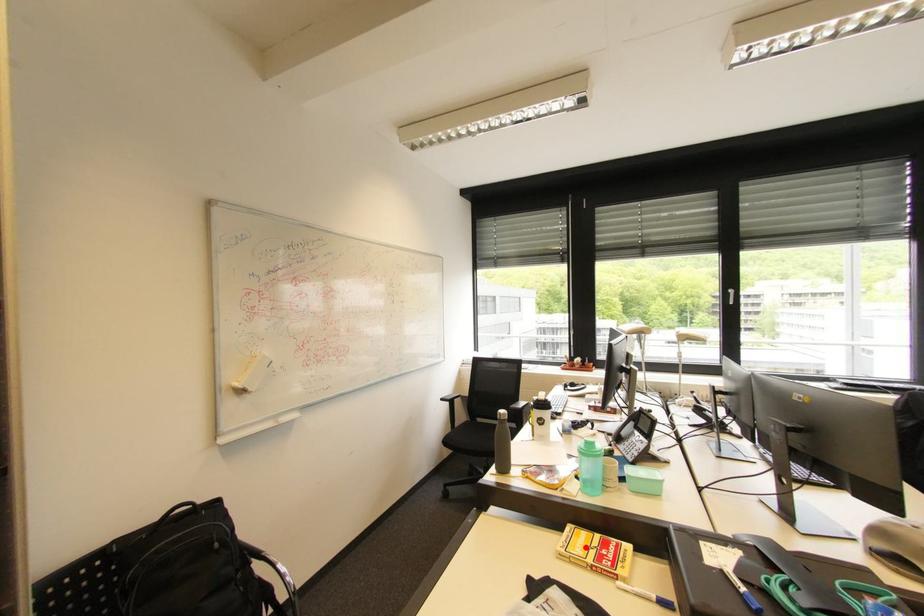
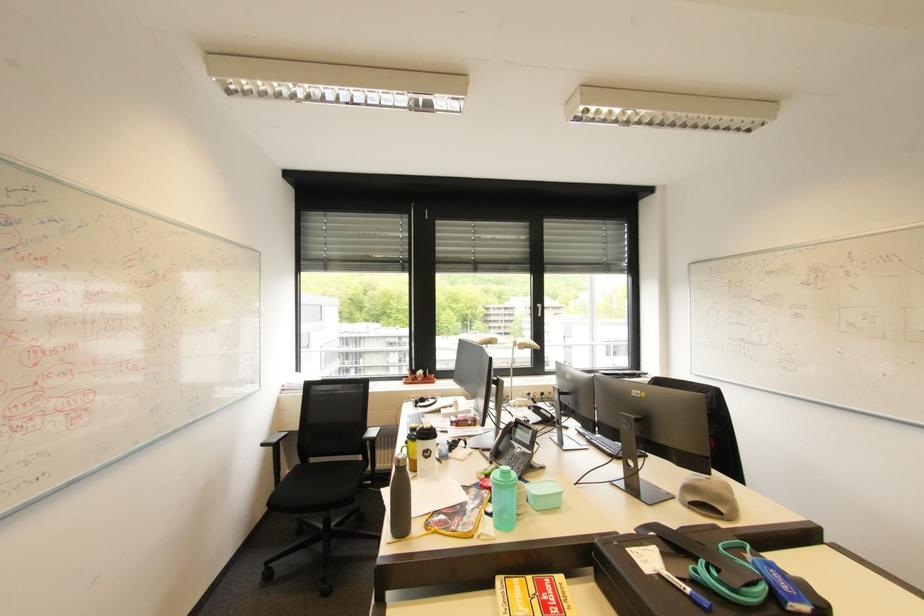
Find the pixel in the second image that matches the highlighted location in the first image.

(526, 602)